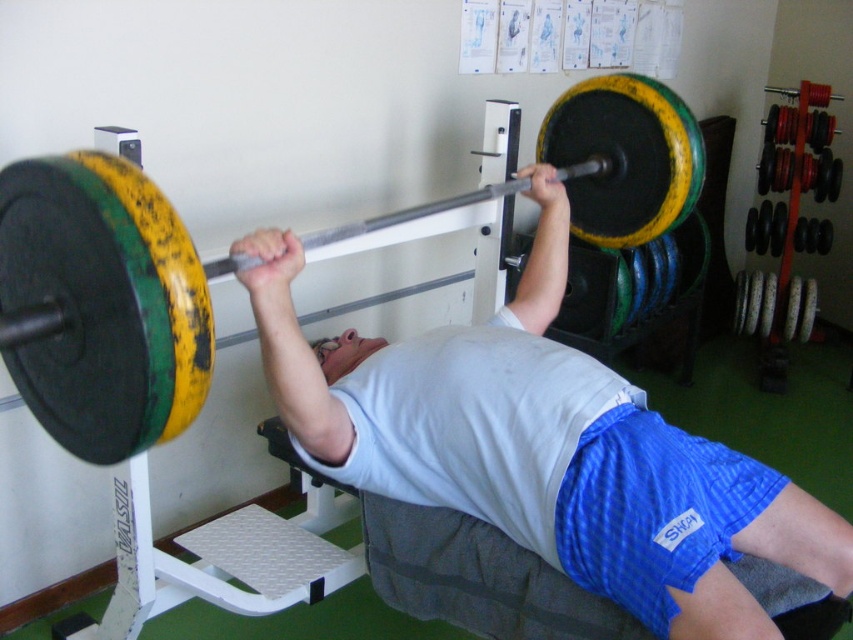
Based on the photo, who is positioned more to the right, matte black barbell at center or yellow-green painted barbell at center?

matte black barbell at center is more to the right.

Is point (614, 374) behind point (195, 323)?

Yes, it is behind point (195, 323).

The width and height of the screenshot is (853, 640). I want to click on matte black barbell at center, so click(543, 445).